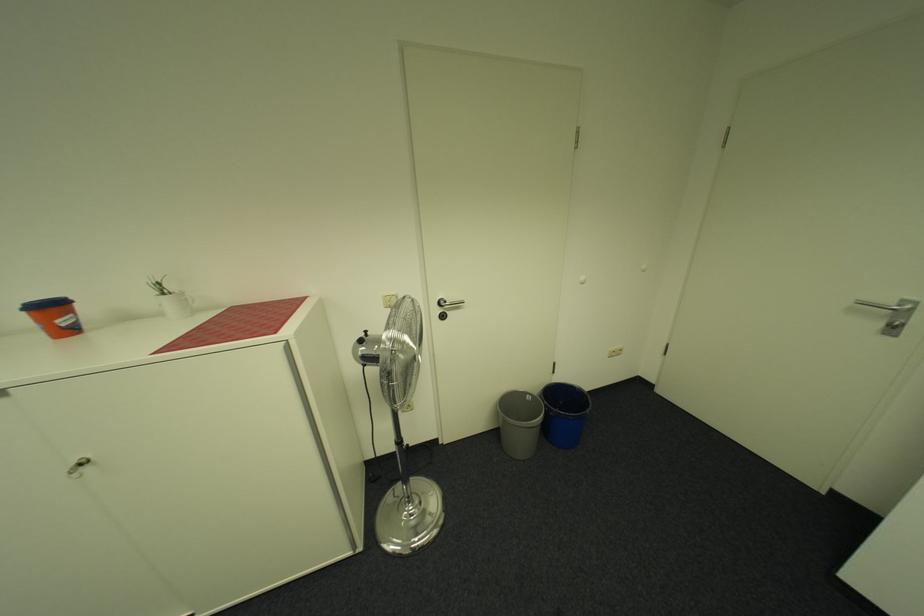
The width and height of the screenshot is (924, 616). What do you see at coordinates (891, 305) in the screenshot? I see `the silver door handle` at bounding box center [891, 305].